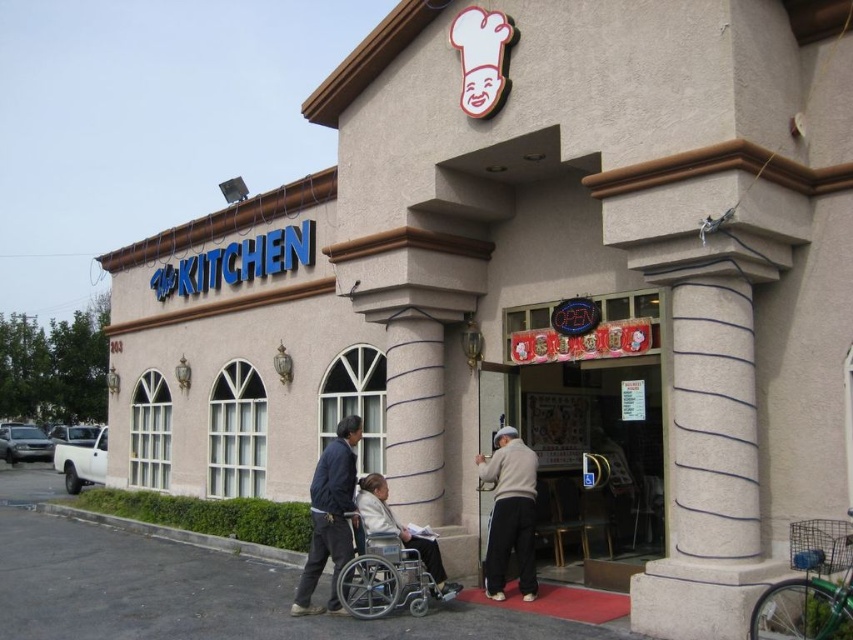
You are a customer arriving at The Kitchen restaurant. You see a dark blue jacket at center and a white fabric wheelchair at lower center. Which object appears narrower when viewed from the entrance?

The dark blue jacket at center is thinner than the white fabric wheelchair at lower center, so the dark blue jacket at center appears narrower.

You are standing outside The Kitchen restaurant and notice a dark blue jacket at center. Where exactly is the dark blue jacket located in relation to the entrance?

The dark blue jacket at center is located at point 0.806 on the x axis and 0.388 on the y axis.